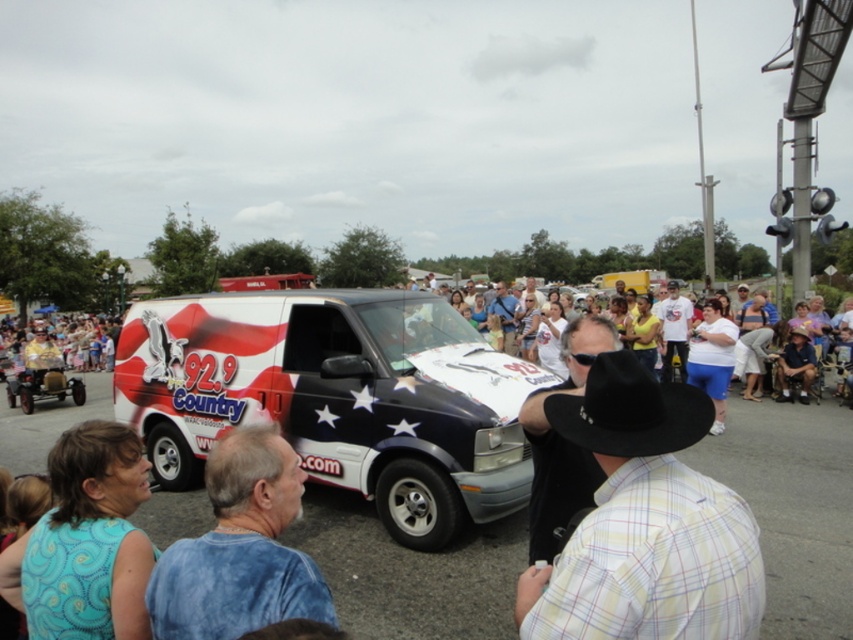
You are standing at the van and want to take a photo of the crowd. You notice two points marked in the scene. Which point, point [167,550] or point [120,480], is closer to your camera lens?

Point [167,550] is closer to the camera lens than point [120,480].

You are at the parade and see two people wearing shirts. One is wearing a plaid cotton shirt at center and the other a white cotton shirt at left. Which shirt is more to the left?

The white cotton shirt at left is more to the left.